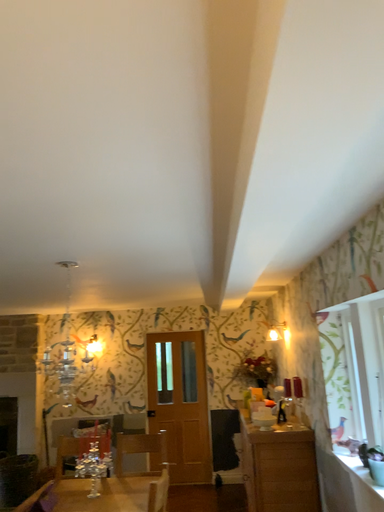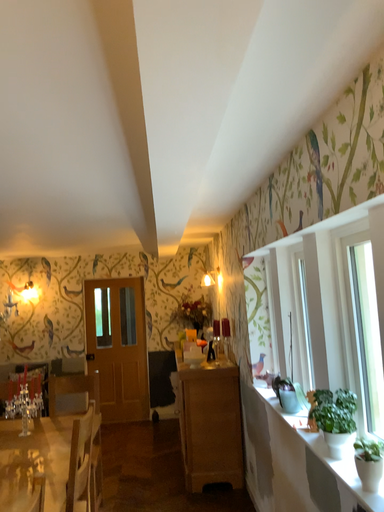
Question: How did the camera likely rotate when shooting the video?

Choices:
 (A) rotated downward
 (B) rotated upward

Answer: (A)